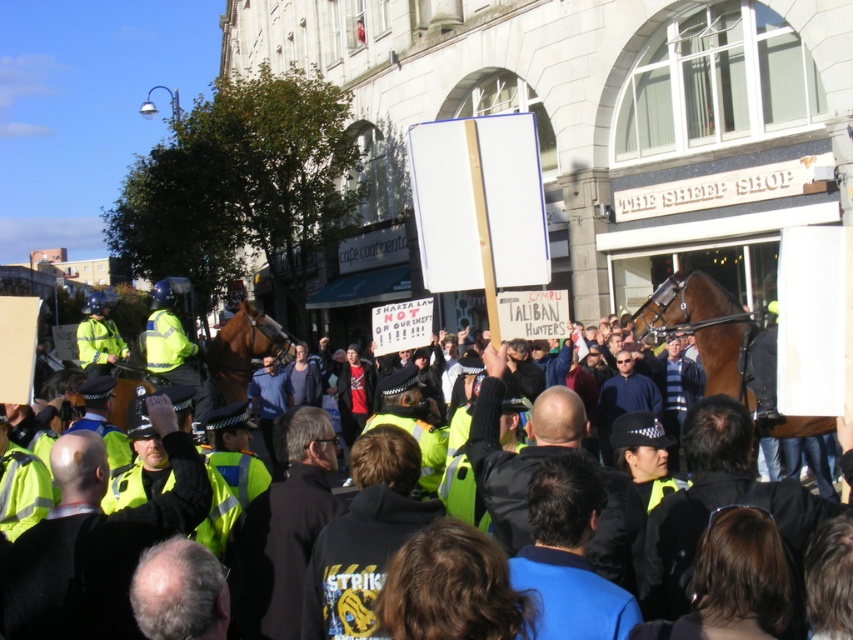
Question: Can you confirm if blue fabric jacket at center is wider than brown glossy horse at center?

Choices:
 (A) no
 (B) yes

Answer: (A)

Question: Which point appears farthest from the camera in this image?

Choices:
 (A) (181, 540)
 (B) (610, 552)
 (C) (90, 371)

Answer: (C)

Question: Is dark blue jacket at center positioned before high-visibility yellow jacket at center-left?

Choices:
 (A) no
 (B) yes

Answer: (B)

Question: Which object is closer to the camera taking this photo?

Choices:
 (A) bald head at lower left
 (B) blue fabric jacket at center

Answer: (A)

Question: Does yellow reflective vest at center have a greater width compared to brown glossy horse at center?

Choices:
 (A) no
 (B) yes

Answer: (B)

Question: Which of these objects is positioned closest to the brown glossy horse at center-right?

Choices:
 (A) high-visibility yellow jacket at center-left
 (B) brown glossy horse at center
 (C) bald head at lower left
 (D) dark blue jacket at center

Answer: (D)